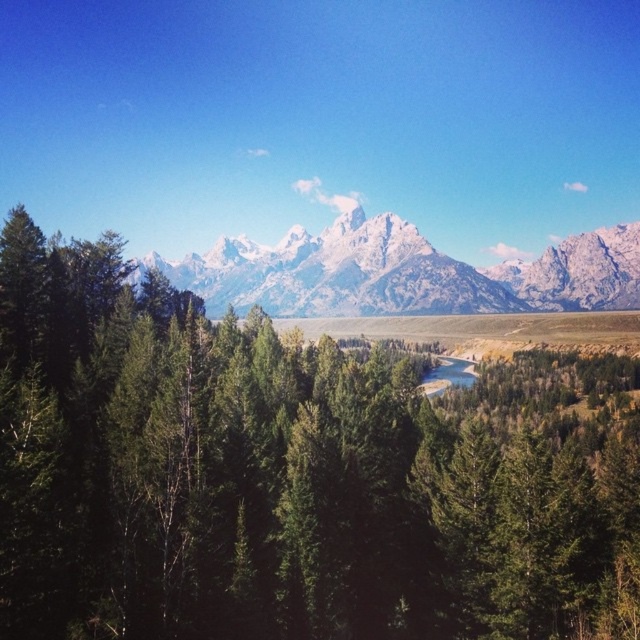
Question: Which of these objects is positioned closest to the green matte tree at center?

Choices:
 (A) clear blue water at center
 (B) white snow-covered mountain range at center

Answer: (A)

Question: Can you confirm if green matte tree at center is wider than clear blue water at center?

Choices:
 (A) yes
 (B) no

Answer: (A)

Question: Which object is closer to the camera taking this photo?

Choices:
 (A) green matte tree at center
 (B) clear blue water at center
 (C) white snow-covered mountain range at center

Answer: (A)

Question: Which point is farther to the camera?

Choices:
 (A) white snow-covered mountain range at center
 (B) clear blue water at center

Answer: (B)

Question: From the image, what is the correct spatial relationship of white snow-covered mountain range at center in relation to clear blue water at center?

Choices:
 (A) below
 (B) above

Answer: (B)

Question: Does green matte tree at center lie behind white snow-covered mountain range at center?

Choices:
 (A) no
 (B) yes

Answer: (A)